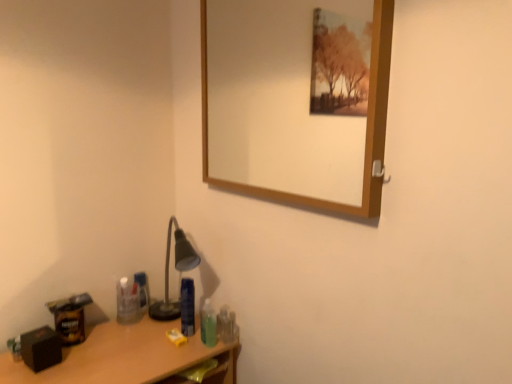
Question: Does point (156, 339) appear closer or farther from the camera than point (227, 327)?

Choices:
 (A) farther
 (B) closer

Answer: (B)

Question: From a real-world perspective, is wooden desk at lower left physically located above or below translucent plastic toothbrush at lower right, the 2th toiletry positioned from the front?

Choices:
 (A) below
 (B) above

Answer: (A)

Question: Which object is positioned farthest from the wooden-framed mirror at upper center?

Choices:
 (A) blue plastic bottle at lower center, the 2th toiletry from the left
 (B) wooden desk at lower left
 (C) translucent plastic toothbrush at lower right, which appears as the fourth toiletry when viewed from the left
 (D) translucent plastic bottle at center, positioned as the 4th toiletry in front-to-back order
 (E) translucent plastic bottle at lower center, the first toiletry from the front

Answer: (C)

Question: Considering the real-world distances, which object is farthest from the translucent plastic bottle at lower center, the 3th toiletry positioned from the left?

Choices:
 (A) translucent plastic bottle at center, arranged as the fourth toiletry when viewed from the right
 (B) blue plastic bottle at lower center, the 2th toiletry when ordered from back to front
 (C) wooden-framed mirror at upper center
 (D) wooden desk at lower left
 (E) translucent plastic toothbrush at lower right, the 2th toiletry positioned from the front

Answer: (C)